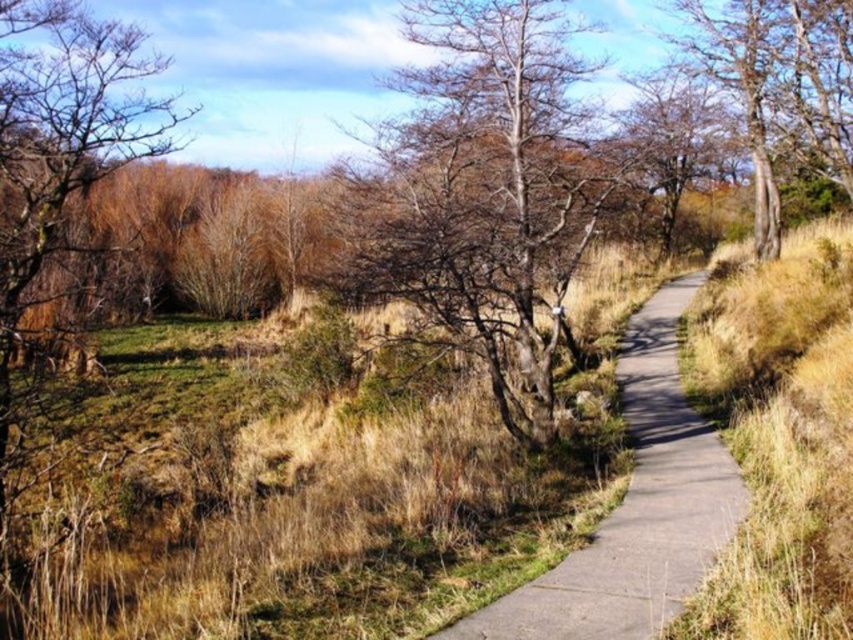
Which is below, concrete at center or bare branches at left?

concrete at center is lower down.

Does concrete at center appear under bare branches at left?

Yes.

Is point (648, 632) farther from viewer compared to point (4, 280)?

No, (648, 632) is closer to viewer.

The height and width of the screenshot is (640, 853). I want to click on concrete at center, so click(x=636, y=508).

Can you confirm if bare branches at center is positioned to the right of bare branches at left?

Indeed, bare branches at center is positioned on the right side of bare branches at left.

Is bare branches at center shorter than bare branches at left?

In fact, bare branches at center may be taller than bare branches at left.

Does point (563, 179) come farther from viewer compared to point (155, 115)?

No, it is in front of (155, 115).

At what (x,y) coordinates should I click in order to perform the action: click on bare branches at center. Please return your answer as a coordinate pair (x, y). The width and height of the screenshot is (853, 640). Looking at the image, I should click on (480, 193).

Can you confirm if bare branches at center is taller than bare wood tree at upper right?

No.

Does point (494, 275) come closer to viewer compared to point (703, 61)?

Yes.

The image size is (853, 640). What do you see at coordinates (480, 193) in the screenshot? I see `bare branches at center` at bounding box center [480, 193].

I want to click on bare branches at center, so click(x=480, y=193).